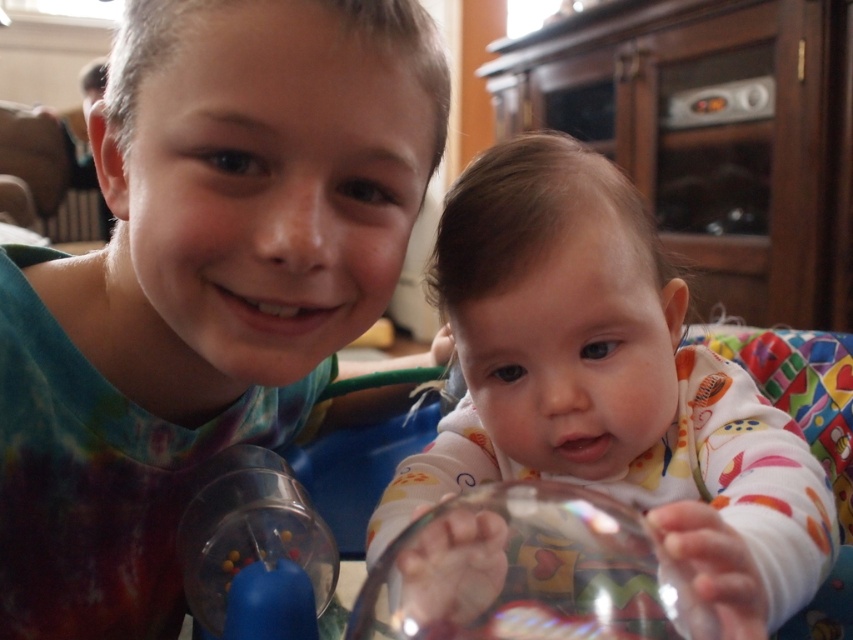
You are a photographer standing at a certain distance from the white soft baby at center. You want to take a close up photo of the baby. Is the current distance sufficient for a clear close up?

The white soft baby at center is 13.84 inches from the camera. Since a typical close up requires the subject to be within 12 inches, the current distance may not be sufficient for a clear close up. Move closer to ensure clarity.